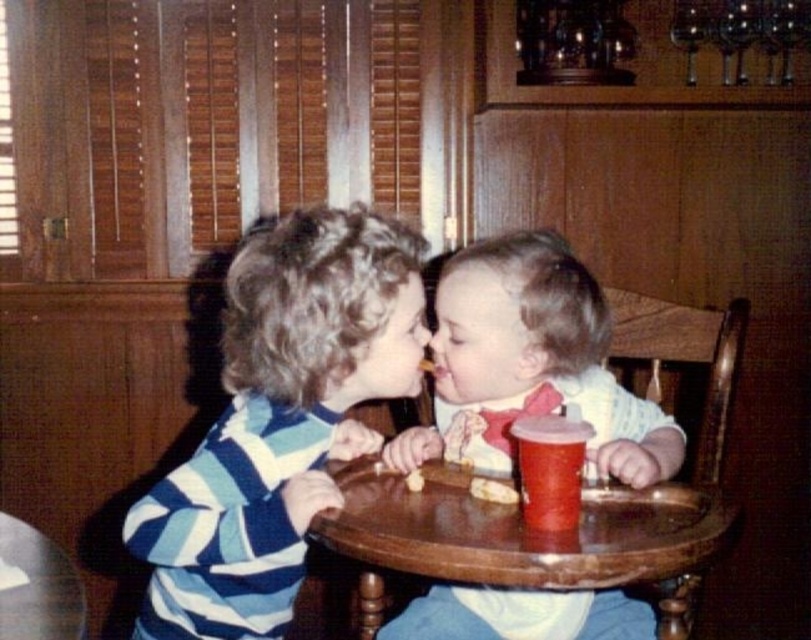
You are a parent trying to place a small toy on the wooden tray at center. What are the coordinates where you should place the toy to ensure it is centered on the tray?

The wooden tray at center is located at coordinates point (522, 540), so placing the toy at those coordinates would center it on the tray.

You are a parent observing two children playing at the wooden table at lower left and the golden crumbly biscuit at center. Which object is located to the left of the other?

The wooden table at lower left is positioned on the left side of golden crumbly biscuit at center.